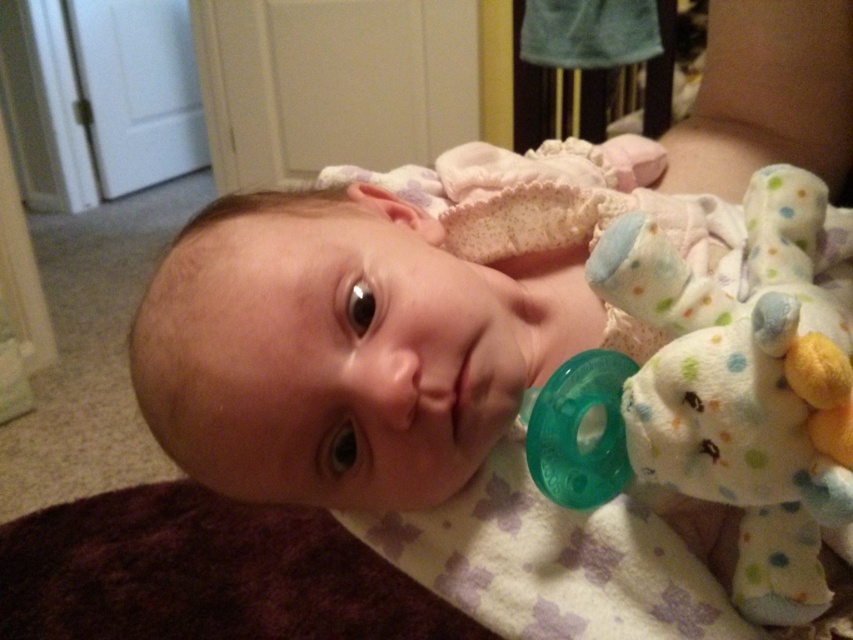
Between white dotted plush toy at right and teeth at center, which one appears on the right side from the viewer's perspective?

Positioned to the right is white dotted plush toy at right.

Can you confirm if white dotted plush toy at right is thinner than teeth at center?

No, white dotted plush toy at right is not thinner than teeth at center.

Who is more distant from viewer, (680, 435) or (465, 426)?

Positioned behind is point (465, 426).

Locate an element on the screen. This screenshot has width=853, height=640. white dotted plush toy at right is located at coordinates (746, 387).

Locate an element on the screen. white soft baby at center is located at coordinates (387, 316).

Which is behind, point (267, 381) or point (479, 412)?

The point (479, 412) is more distant.

Who is more distant from viewer, (442, 474) or (469, 424)?

The point (442, 474) is more distant.

You are a GUI agent. You are given a task and a screenshot of the screen. Output one action in this format:
    pyautogui.click(x=<x>, y=<y>)
    Task: Click on the white soft baby at center
    The height and width of the screenshot is (640, 853).
    Given the screenshot: What is the action you would take?
    pyautogui.click(x=387, y=316)

Consider the image. Does white soft baby at center appear on the right side of white dotted plush toy at right?

No, white soft baby at center is not to the right of white dotted plush toy at right.

Consider the image. Who is positioned more to the right, white soft baby at center or white dotted plush toy at right?

white dotted plush toy at right

Is point (303, 225) positioned behind point (809, 314)?

Yes.

Locate an element on the screen. white soft baby at center is located at coordinates (387, 316).